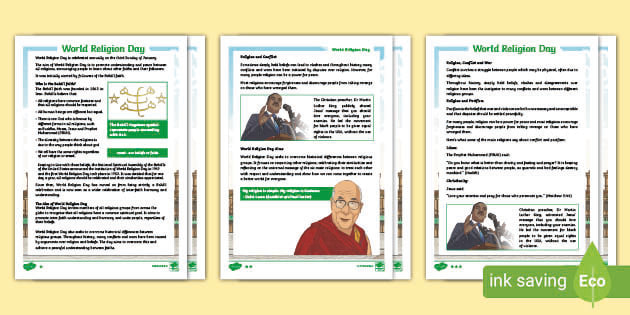
At what (x,y) coordinates should I click in order to perform the action: click on space below posters. Please return your answer as a coordinate pair (x, y). Looking at the image, I should click on (142, 305), (266, 291), (457, 291).